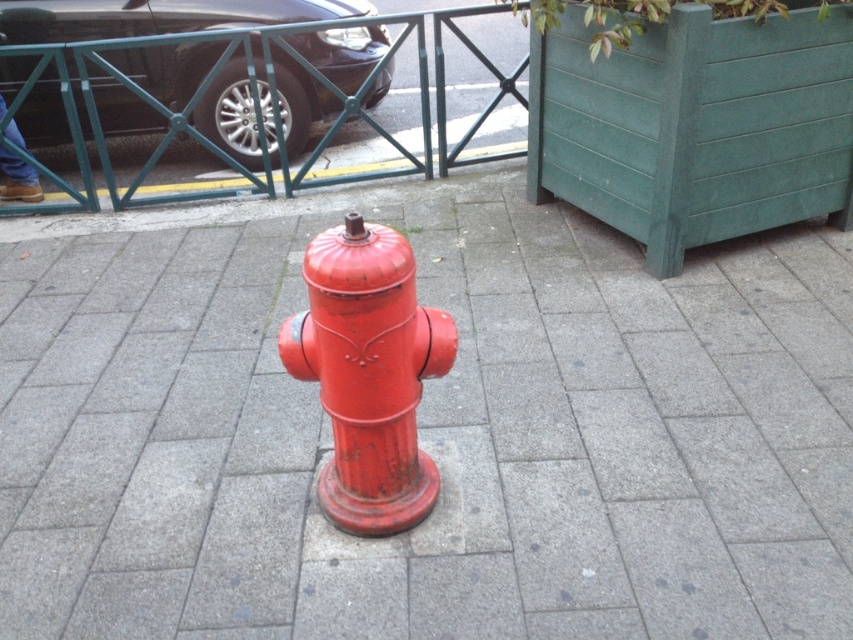
Does glossy black car at upper left lie behind glossy red fire hydrant at center?

Yes, it is behind glossy red fire hydrant at center.

What are the coordinates of `glossy black car at upper left` in the screenshot? It's located at (155, 17).

What do you see at coordinates (155, 17) in the screenshot? Image resolution: width=853 pixels, height=640 pixels. I see `glossy black car at upper left` at bounding box center [155, 17].

Locate an element on the screen. The width and height of the screenshot is (853, 640). glossy black car at upper left is located at coordinates (155, 17).